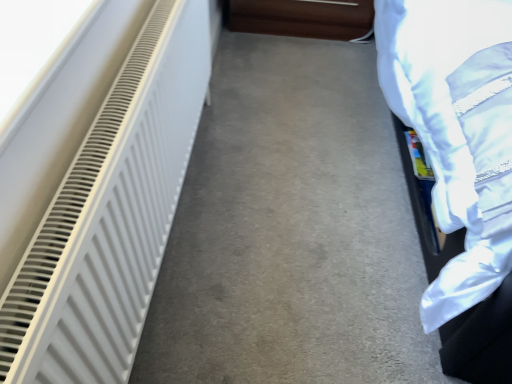
Locate an element on the screen. Image resolution: width=512 pixels, height=384 pixels. free spot above white matte radiator at left (from a real-world perspective) is located at coordinates (292, 166).